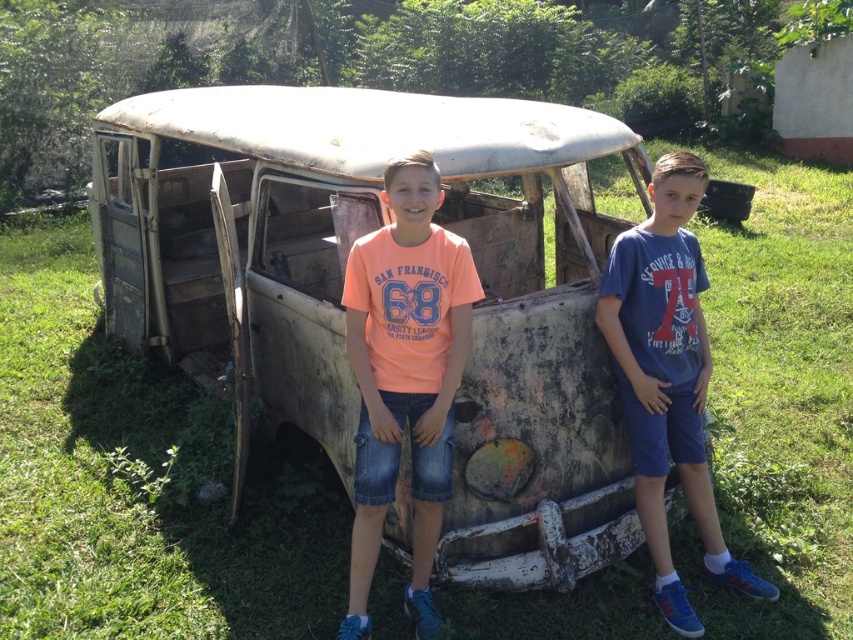
Does rusty metal car at center appear under orange t-shirt at center?

No.

Between rusty metal car at center and orange t-shirt at center, which one is positioned lower?

orange t-shirt at center

Is point (299, 173) positioned after point (386, 378)?

That is True.

You are a GUI agent. You are given a task and a screenshot of the screen. Output one action in this format:
    pyautogui.click(x=<x>, y=<y>)
    Task: Click on the rusty metal car at center
    
    Given the screenshot: What is the action you would take?
    [x=341, y=285]

Can you confirm if orange t-shirt at center is wider than blue denim shorts at right?

No.

Between point (384, 470) and point (635, 484), which one is positioned in front?

Positioned in front is point (384, 470).

You are a GUI agent. You are given a task and a screenshot of the screen. Output one action in this format:
    pyautogui.click(x=<x>, y=<y>)
    Task: Click on the orange t-shirt at center
    This screenshot has width=853, height=640.
    Given the screenshot: What is the action you would take?
    pyautogui.click(x=405, y=376)

Can you confirm if rusty metal car at center is thinner than blue denim shorts at right?

No.

Does rusty metal car at center lie behind blue denim shorts at right?

That is False.

Is point (505, 470) farther from viewer compared to point (688, 161)?

Yes, point (505, 470) is farther from viewer.

The width and height of the screenshot is (853, 640). Find the location of `rusty metal car at center`. rusty metal car at center is located at coordinates (341, 285).